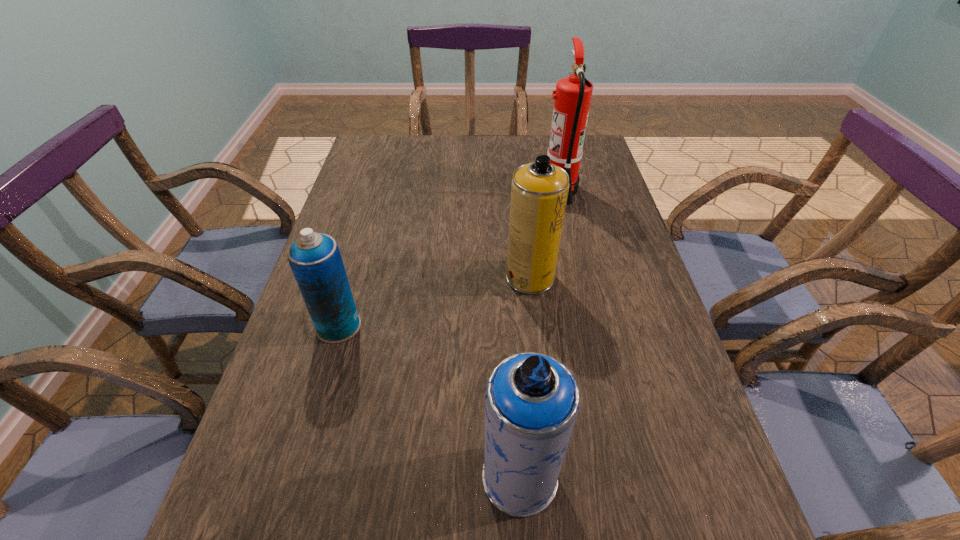
Where is `the rightmost object`? The height and width of the screenshot is (540, 960). the rightmost object is located at coordinates (573, 94).

The height and width of the screenshot is (540, 960). I want to click on the tallest object, so click(573, 94).

The height and width of the screenshot is (540, 960). Find the location of `the farthest aerosol can`. the farthest aerosol can is located at coordinates (539, 191).

The width and height of the screenshot is (960, 540). I want to click on the nearest object, so click(x=532, y=400).

Locate an element on the screen. the shortest object is located at coordinates (315, 260).

Find the location of `the second nearest object`. the second nearest object is located at coordinates (315, 260).

This screenshot has width=960, height=540. I want to click on vacant space located at the nozzle of the fire extinguisher, so click(463, 190).

This screenshot has width=960, height=540. In order to click on blank area located 0.180m at the nozzle of the fire extinguisher in this screenshot , I will do click(x=483, y=190).

The height and width of the screenshot is (540, 960). I want to click on free space located 0.400m at the nozzle of the fire extinguisher, so click(x=410, y=190).

At what (x,y) coordinates should I click in order to perform the action: click on vacant space located on the back of the farthest aerosol can. Please return your answer as a coordinate pair (x, y). The image size is (960, 540). Looking at the image, I should click on (524, 226).